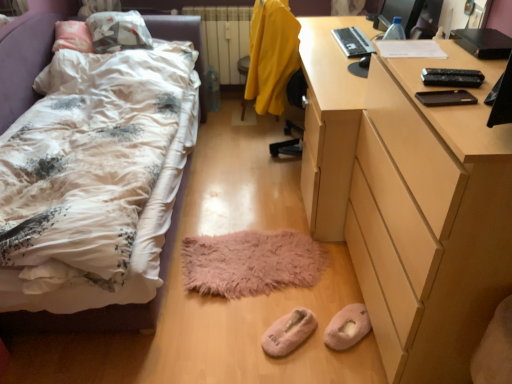
The width and height of the screenshot is (512, 384). In order to click on empty space that is ontop of light brown wooden desk at right (from a real-world perspective) in this screenshot , I will do `click(457, 68)`.